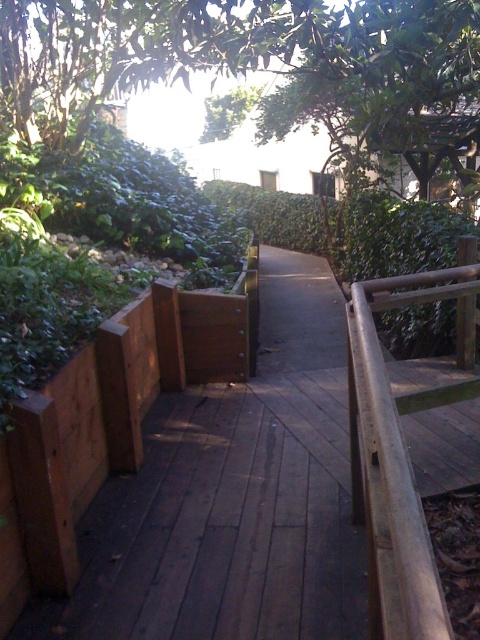
You are standing on the brown wooden deck at center and want to reach the brown wooden rail at right. According to the scene description, which direction should you move to get there?

Since the brown wooden deck at center is below the brown wooden rail at right, you should move upward to reach the brown wooden rail at right from the brown wooden deck at center.

You are a painter who needs to place a 1.2 meter wide canvas on the scene. You have to choose between the brown wooden deck at center and the brown wooden rail at right. Which one can accommodate the canvas without overhanging?

The brown wooden rail at right is wider than the brown wooden deck at center. Since the deck is thinner, the rail can support the 1.2 meter wide canvas.

You are standing on the brown wooden deck at center and want to reach the brown wooden rail at right. Which direction should you move to get closer to the rail?

Since the brown wooden deck at center occupies less space than the brown wooden rail at right, you should move to the right to get closer to the rail.